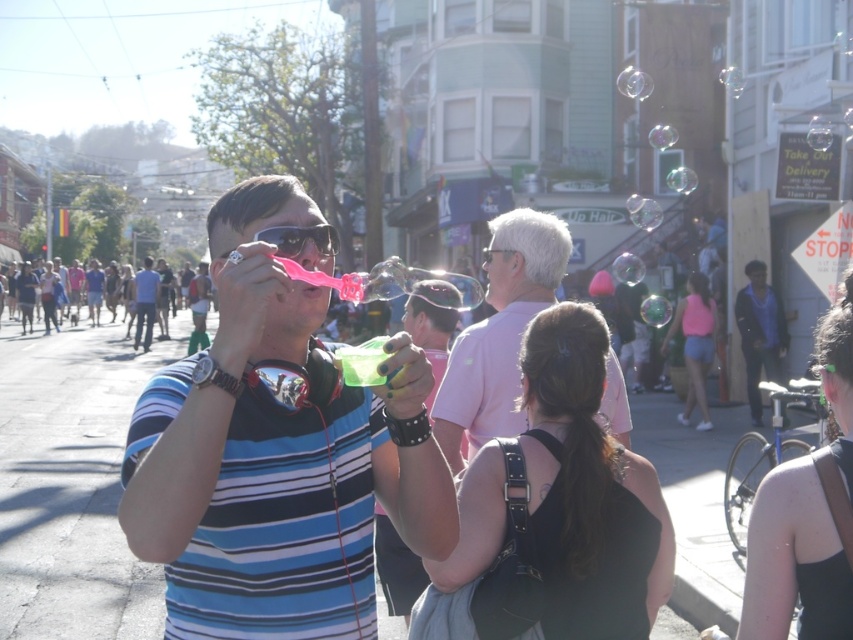
You are a photographer trying to capture a closeup of the man blowing bubbles. You notice two points in the scene marked as point 1 at coordinates point (270, 237) and point 2 at coordinates point (134, 294). Which point should you focus on to ensure the man is in focus?

You should focus on point 1 at coordinates point (270, 237) because it is closer to the camera than point 2 at coordinates point (134, 294), ensuring the man blowing bubbles is in focus.

Based on the scene description, can you determine which object is smaller between the black fabric hair at upper right and the blue striped shirt at center?

The black fabric hair at upper right is smaller than the blue striped shirt at center according to the description.

You are a photographer trying to capture a detailed closeup of the man blowing bubbles in the street scene. You notice two points marked in the image at coordinates point (808,525) and point (143,346). Which point should you focus on to ensure the man is in sharp focus?

You should focus on point (808,525) because it is closer to the camera than point (143,346), ensuring the man blowing bubbles is in sharp focus.